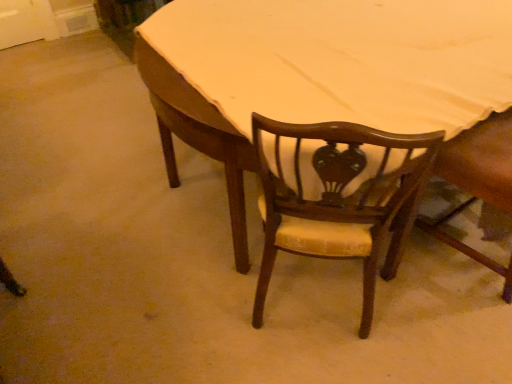
Where is `free spot in front of wooden chair at center, positioned as the 1th chair in left-to-right order`? This screenshot has height=384, width=512. free spot in front of wooden chair at center, positioned as the 1th chair in left-to-right order is located at coordinates (317, 364).